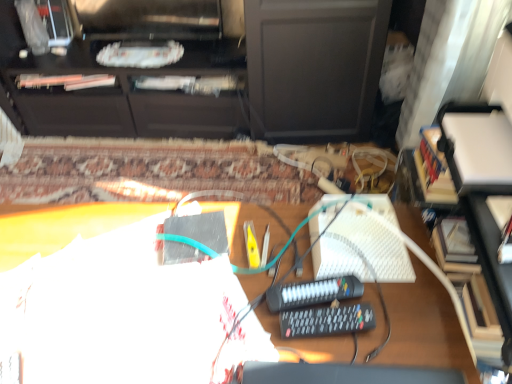
Question: Is black matte cabinet at upper center positioned behind black plastic remote control at center, which is counted as the 2th equipment, starting from the back?

Choices:
 (A) no
 (B) yes

Answer: (B)

Question: From the image's perspective, would you say black matte cabinet at upper center is shown under black plastic remote control at center, which is counted as the 2th equipment, starting from the back?

Choices:
 (A) no
 (B) yes

Answer: (A)

Question: Does black matte cabinet at upper center have a larger size compared to black plastic remote control at center, marked as the 1th equipment in a front-to-back arrangement?

Choices:
 (A) no
 (B) yes

Answer: (B)

Question: Is black matte cabinet at upper center to the left of black plastic remote control at center, which is counted as the 2th equipment, starting from the back, from the viewer's perspective?

Choices:
 (A) no
 (B) yes

Answer: (B)

Question: Considering the relative sizes of black matte cabinet at upper center and black plastic remote control at center, marked as the 1th equipment in a front-to-back arrangement, in the image provided, is black matte cabinet at upper center taller than black plastic remote control at center, marked as the 1th equipment in a front-to-back arrangement,?

Choices:
 (A) yes
 (B) no

Answer: (A)

Question: From the image's perspective, is white matte desk at center positioned above or below black plastic remote control at center, marked as the 1th equipment in a front-to-back arrangement?

Choices:
 (A) above
 (B) below

Answer: (B)

Question: From a real-world perspective, is white matte desk at center positioned above or below black plastic remote control at center, which is counted as the 2th equipment, starting from the back?

Choices:
 (A) above
 (B) below

Answer: (B)

Question: Considering the relative positions of white matte desk at center and black plastic remote control at center, which is counted as the 2th equipment, starting from the back, in the image provided, is white matte desk at center to the left or to the right of black plastic remote control at center, which is counted as the 2th equipment, starting from the back,?

Choices:
 (A) left
 (B) right

Answer: (A)

Question: In terms of height, does white matte desk at center look taller or shorter compared to black plastic remote control at center, marked as the 1th equipment in a front-to-back arrangement?

Choices:
 (A) short
 (B) tall

Answer: (B)

Question: Which is correct: black plastic remote control at center, arranged as the 1th equipment when viewed from the back, is inside white textured keyboard at center-right, or outside of it?

Choices:
 (A) inside
 (B) outside

Answer: (B)

Question: From the image's perspective, relative to white textured keyboard at center-right, is black plastic remote control at center, arranged as the 1th equipment when viewed from the back, above or below?

Choices:
 (A) below
 (B) above

Answer: (A)

Question: In terms of size, does black plastic remote control at center, which appears as the second equipment when viewed from the front, appear bigger or smaller than white textured keyboard at center-right?

Choices:
 (A) small
 (B) big

Answer: (A)

Question: In terms of width, does black plastic remote control at center, arranged as the 1th equipment when viewed from the back, look wider or thinner when compared to white textured keyboard at center-right?

Choices:
 (A) thin
 (B) wide

Answer: (B)

Question: Considering their positions, is white textured keyboard at center-right located in front of or behind black plastic remote control at center, arranged as the 1th equipment when viewed from the back?

Choices:
 (A) front
 (B) behind

Answer: (B)

Question: Is white textured keyboard at center-right wider or thinner than black plastic remote control at center, which appears as the second equipment when viewed from the front?

Choices:
 (A) wide
 (B) thin

Answer: (B)